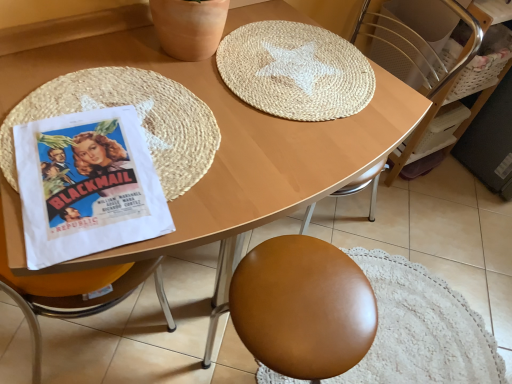
I want to click on free space to the right of white paper poster at left, so click(231, 181).